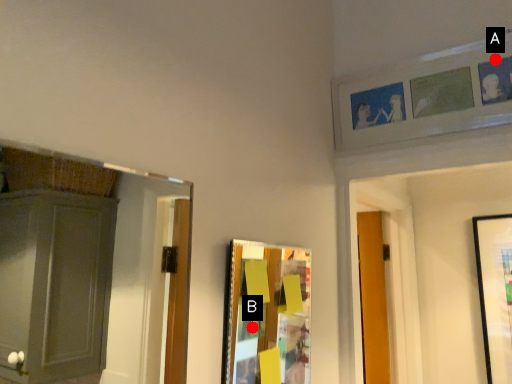
Question: Two points are circled on the image, labeled by A and B beside each circle. Which point is closer to the camera?

Choices:
 (A) A is closer
 (B) B is closer

Answer: (B)